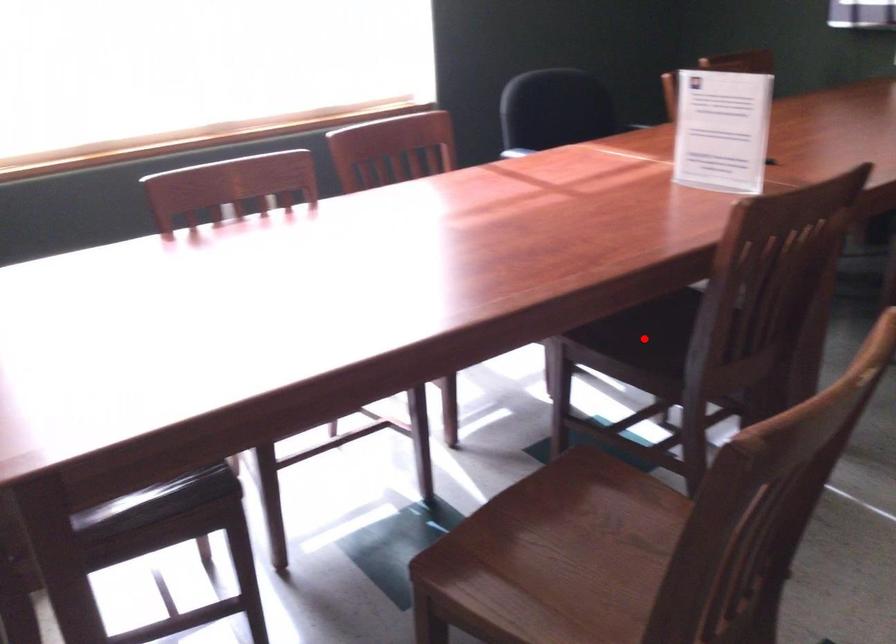
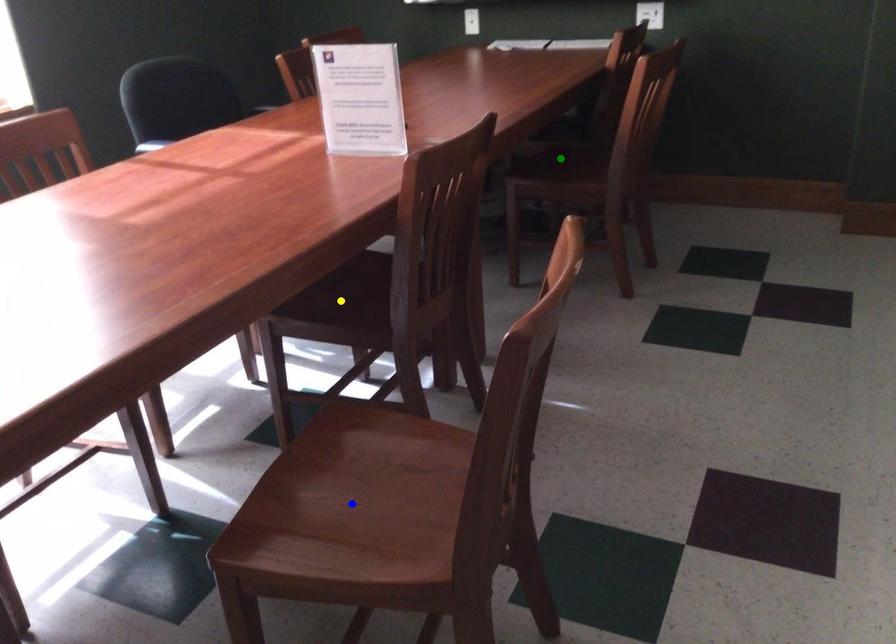
Question: I am providing you with two images of the same scene from different viewpoints. A red point is marked on the first image. You are given multiple points on the second image. Which mark in image 2 goes with the point in image 1?

Choices:
 (A) green point
 (B) blue point
 (C) yellow point

Answer: (C)